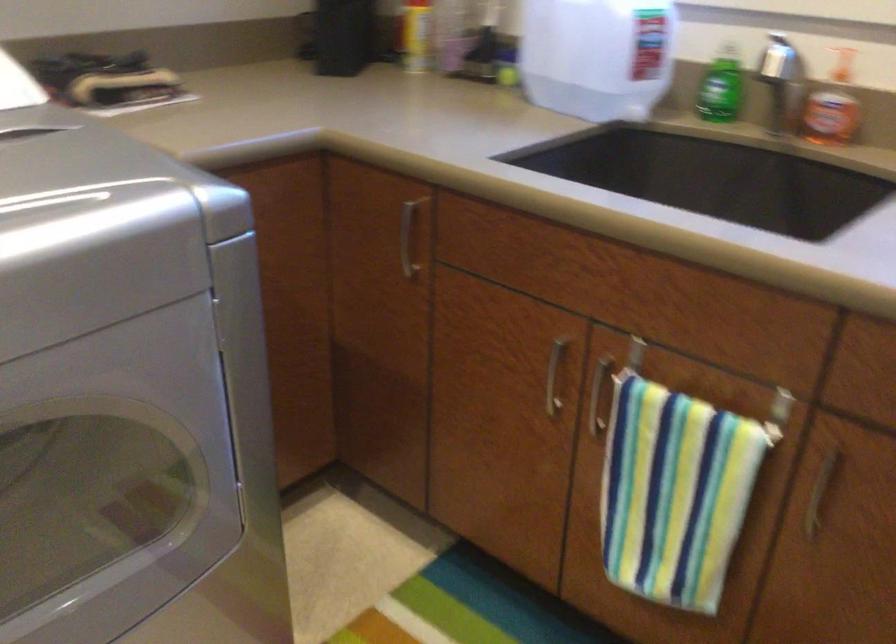
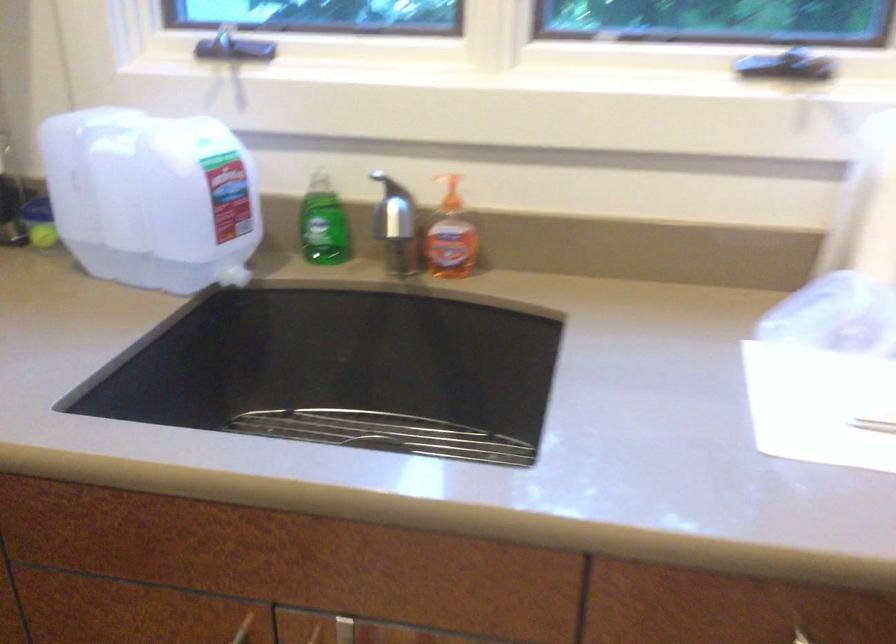
Question: How did the camera likely rotate?

Choices:
 (A) Left
 (B) Right
 (C) Up
 (D) Down

Answer: (B)